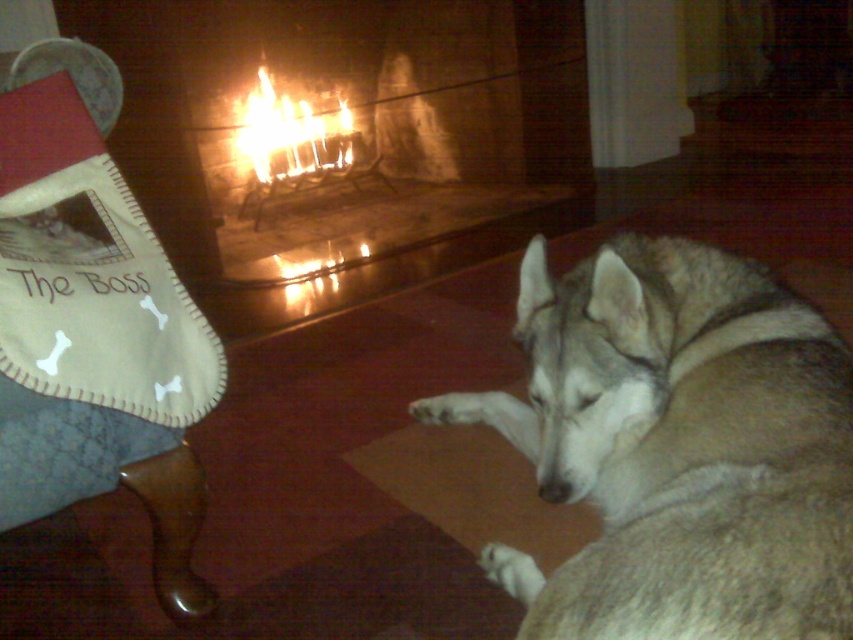
Question: Which is nearer to the brick fireplace at center?

Choices:
 (A) flamematerial/texture at center
 (B) denim fabric armchair at left

Answer: (A)

Question: Considering the real-world distances, which object is farthest from the brick fireplace at center?

Choices:
 (A) denim fabric armchair at left
 (B) fuzzy gray dog at lower right

Answer: (A)

Question: Estimate the real-world distances between objects in this image. Which object is farther from the denim fabric armchair at left?

Choices:
 (A) brick fireplace at center
 (B) fuzzy gray dog at lower right
 (C) flamematerial/texture at center

Answer: (C)

Question: From the image, what is the correct spatial relationship of fuzzy gray dog at lower right in relation to brick fireplace at center?

Choices:
 (A) below
 (B) above

Answer: (A)

Question: Is denim fabric armchair at left to the left of flamematerial/texture at center from the viewer's perspective?

Choices:
 (A) yes
 (B) no

Answer: (B)

Question: Considering the relative positions of brick fireplace at center and denim fabric armchair at left in the image provided, where is brick fireplace at center located with respect to denim fabric armchair at left?

Choices:
 (A) right
 (B) left

Answer: (A)